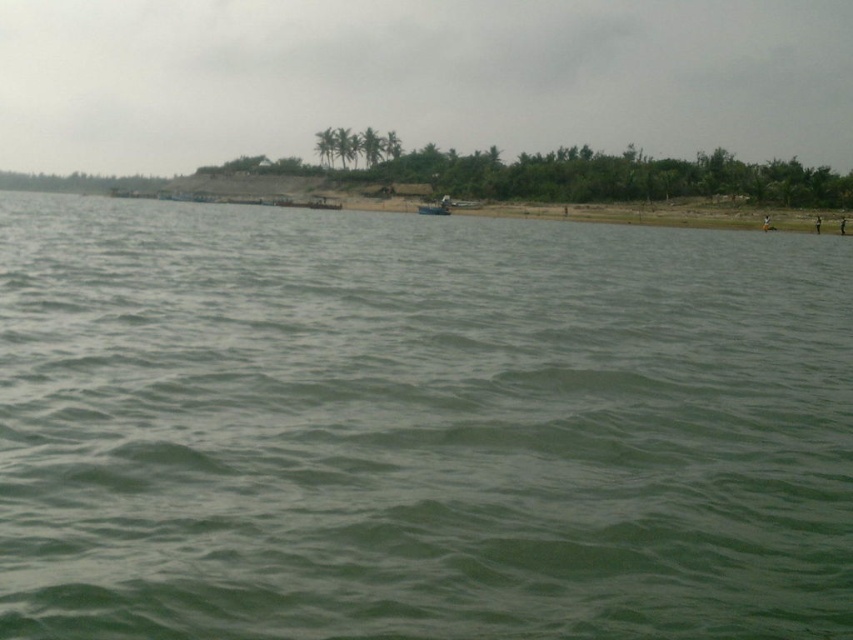
You are planning to take a photo of the metallic gray boat at center and want to ensure the green grassy hill at upper center is visible in the background. Given their sizes, will the boat still be recognizable in the photo?

The green grassy hill at upper center is wider than the metallic gray boat at center, so the boat will still be recognizable as it is smaller and positioned in the foreground compared to the hill in the background.

You are standing on the beach in this coastal scene. You want to walk to the small structure near the center of the beach. If you start from the edge of the green water at center, which direction should you walk to reach the structure?

The small structure is near the center of the beach, so you should walk towards the structure from the edge of the green water at center. Since the structure is partially obscured by foliage, it might be best to head directly toward its visible position while navigating around any vegetation in your path.

You are standing on the beach and see the green water at center and the metallic gray boat at center. Which object is closer to the horizon?

The metallic gray boat at center is closer to the horizon because the green water at center is below it, meaning the boat is positioned higher up in the scene.